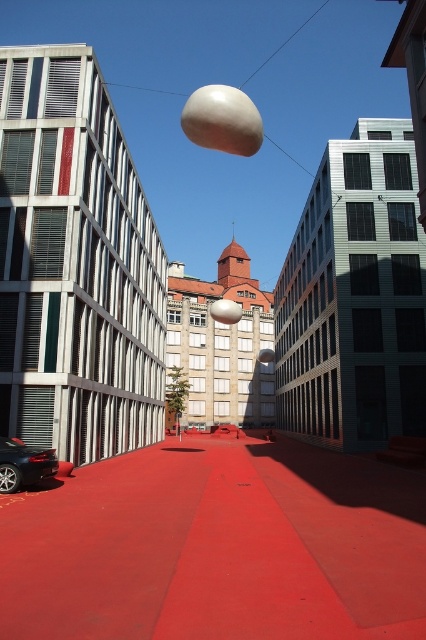
What are the coordinates of the red rubber plaza at center?

The coordinates of the red rubber plaza at center are (218, 547).

You are a pedestrian standing at the entrance of the building and want to reach the red rubber plaza at center. Which direction should you walk relative to the shiny black car at lower left?

The red rubber plaza at center is positioned on the right side of the shiny black car at lower left, so you should walk to the right relative to the shiny black car at lower left to reach it.

You are standing at the starting point of the red pathway in the urban scene. You see two points marked on the pathway. The first point is at coordinate point(x=149, y=616) and the second point is at coordinate point(x=46, y=474). Which point is closer to you as you walk along the pathway?

Point(x=149, y=616) is in front of point(x=46, y=474), so the first point is closer to you as you walk along the pathway.